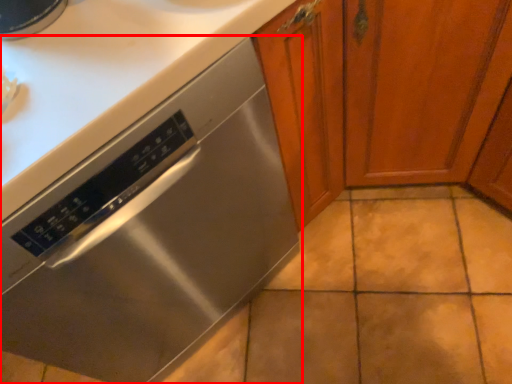
Question: From the image's perspective, what is the correct spatial relationship of home appliance (annotated by the red box) in relation to cabinetry?

Choices:
 (A) above
 (B) below

Answer: (B)